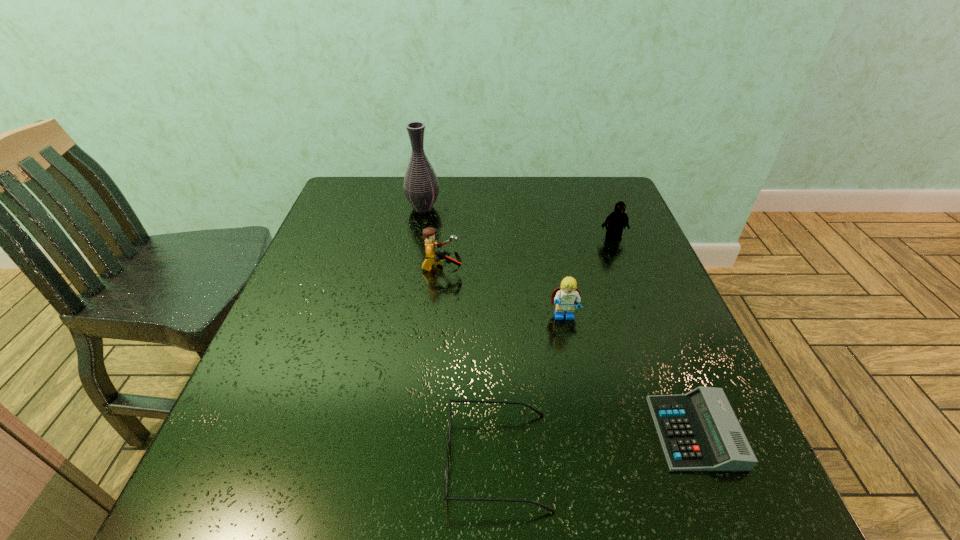
Identify which Lego is the third nearest to the calculator. Please provide its 2D coordinates. Your answer should be formatted as a tuple, i.e. [(x, y)], where the tuple contains the x and y coordinates of a point satisfying the conditions above.

[(617, 220)]

The height and width of the screenshot is (540, 960). Find the location of `vacant area in the image that satisfies the following two spatial constraints: 1. on the front-facing side of the third nearest object; 2. on the front-facing side of the spectacles`. vacant area in the image that satisfies the following two spatial constraints: 1. on the front-facing side of the third nearest object; 2. on the front-facing side of the spectacles is located at coordinates (592, 460).

You are a GUI agent. You are given a task and a screenshot of the screen. Output one action in this format:
    pyautogui.click(x=<x>, y=<y>)
    Task: Click on the free point that satisfies the following two spatial constraints: 1. on the face of the second farthest object; 2. holding a crossbow in the hands of the third farthest object
    This screenshot has width=960, height=540.
    Given the screenshot: What is the action you would take?
    pyautogui.click(x=625, y=269)

At what (x,y) coordinates should I click in order to perform the action: click on vacant point that satisfies the following two spatial constraints: 1. on the face of the farthest Lego; 2. on the front-facing side of the fifth tallest object. Please return your answer as a coordinate pair (x, y). Image resolution: width=960 pixels, height=540 pixels. Looking at the image, I should click on (699, 460).

The width and height of the screenshot is (960, 540). Find the location of `free point that satisfies the following two spatial constraints: 1. on the face of the rightmost Lego; 2. on the front-facing side of the spectacles`. free point that satisfies the following two spatial constraints: 1. on the face of the rightmost Lego; 2. on the front-facing side of the spectacles is located at coordinates (699, 460).

Where is `vacant space that satisfies the following two spatial constraints: 1. on the face of the calculator; 2. on the left side of the rightmost Lego`? This screenshot has width=960, height=540. vacant space that satisfies the following two spatial constraints: 1. on the face of the calculator; 2. on the left side of the rightmost Lego is located at coordinates (688, 433).

Locate an element on the screen. free space in the image that satisfies the following two spatial constraints: 1. on the face of the farthest Lego; 2. holding a crossbow in the hands of the leftmost Lego is located at coordinates (625, 269).